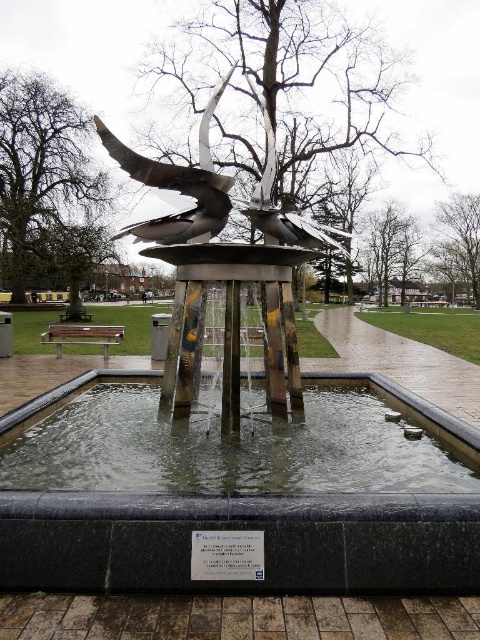
You are a photographer planning to capture the reflection of the polished stainless steel sculpture at center in the clear glass water at center. Based on their positions, can you determine if the reflection will be visible in the water?

The clear glass water at center is to the left of the polished stainless steel sculpture at center, so the reflection of the sculpture may not be directly visible in the water unless the photographer positions themselves appropriately to capture the reflection.

You are standing at the edge of the rectangular water feature in the park. You want to place a small statue exactly at the center of the clear glass water at center. What are the coordinates where you should place it?

The coordinates for the center of the clear glass water at center are at point (228,445).

Based on the photo, you are a maintenance worker needing to clean the polished silver bird at center. The clear glass water at center is in the way. Can you reach the bird without stepping into the water?

The clear glass water at center is wider than the polished silver bird at center. Since the water is wider, you can walk around the edges of the water to access the bird without stepping into it.